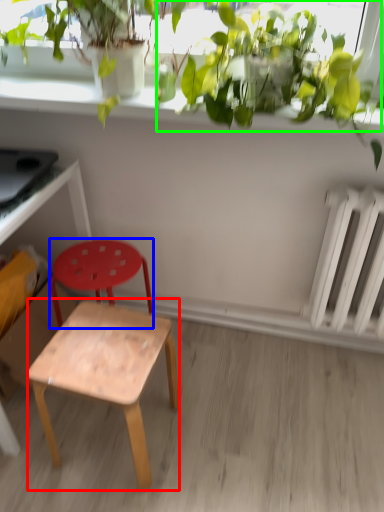
Question: Considering the real-world distances, which object is closest to stool (highlighted by a red box)? stool (highlighted by a blue box) or vegetation (highlighted by a green box).

Choices:
 (A) stool
 (B) vegetation

Answer: (A)